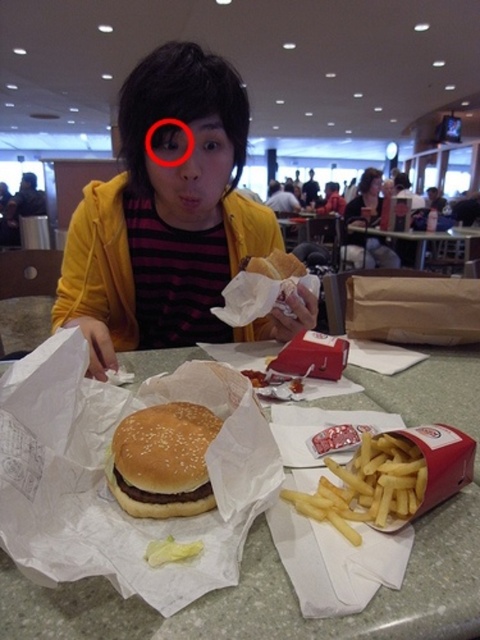
Question: Estimate the real-world distances between objects in this image. Which object is farther from the yellow matte jacket at center?

Choices:
 (A) white paper table at center
 (B) semi-glossy bun at center
 (C) smooth plastic table at center

Answer: (C)

Question: Can you confirm if yellow matte jacket at center is positioned to the left of white paper table at center?

Choices:
 (A) yes
 (B) no

Answer: (A)

Question: Does white paper table at center have a greater width compared to semi-glossy bun at center?

Choices:
 (A) no
 (B) yes

Answer: (B)

Question: In this image, where is white paper table at center located relative to smooth plastic table at center?

Choices:
 (A) below
 (B) above

Answer: (A)

Question: Among these points, which one is farthest from the camera?

Choices:
 (A) (192, 412)
 (B) (236, 83)

Answer: (B)

Question: Which object appears farthest from the camera in this image?

Choices:
 (A) white paper table at center
 (B) yellow matte jacket at center
 (C) semi-glossy bun at center
 (D) smooth plastic table at center

Answer: (D)